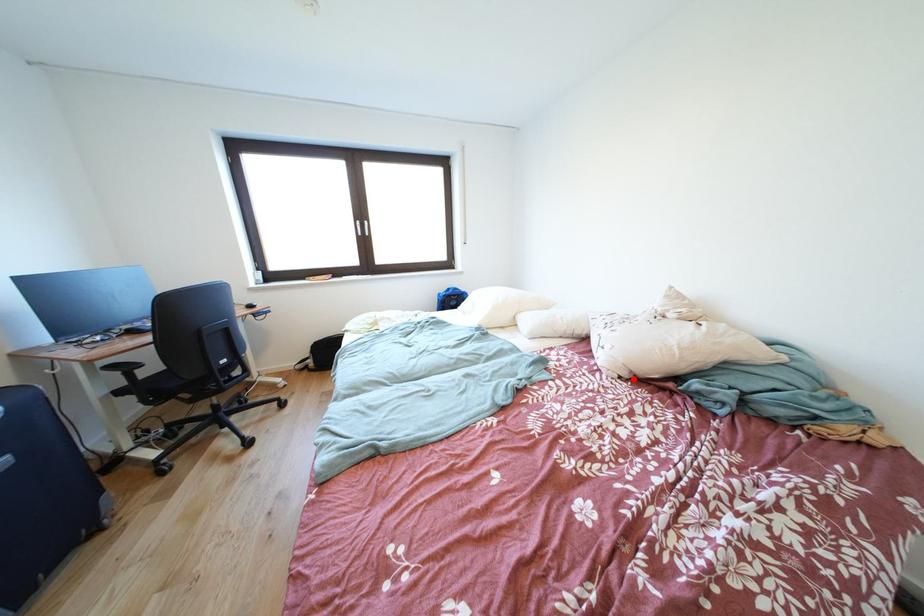
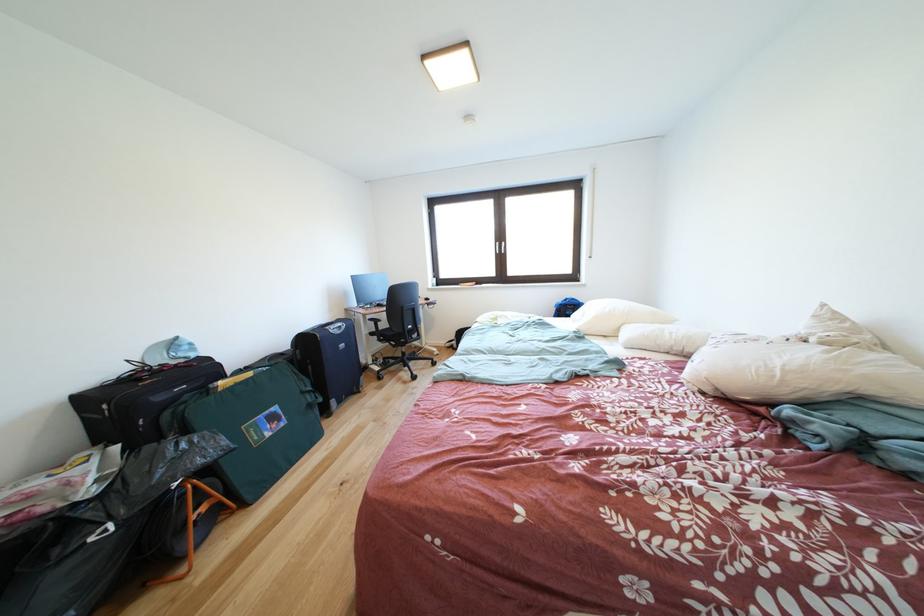
In the second image, find the point that corresponds to the highlighted location in the first image.

(716, 394)